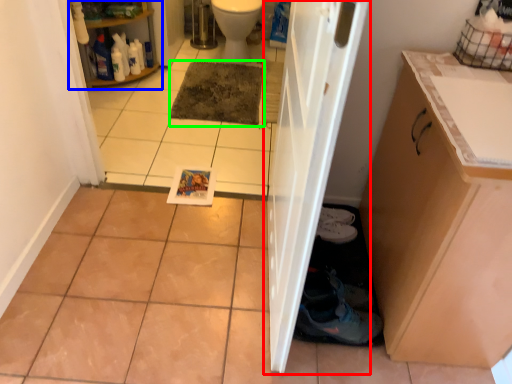
Question: Which object is positioned closest to door (highlighted by a red box)? Select from shelf (highlighted by a blue box) and mat (highlighted by a green box).

Choices:
 (A) shelf
 (B) mat

Answer: (B)